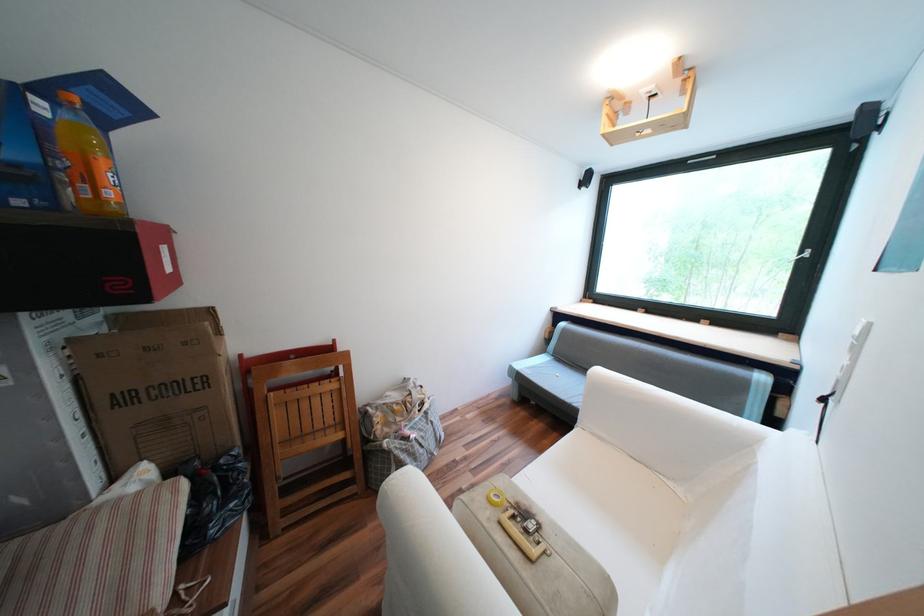
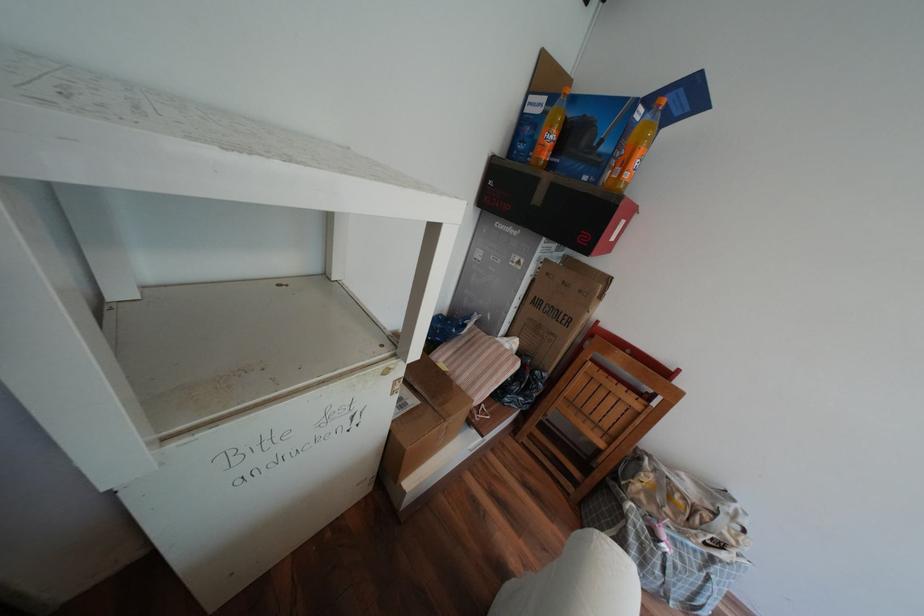
Where in the second image is the point corresponding to point (193, 342) from the first image?

(590, 291)